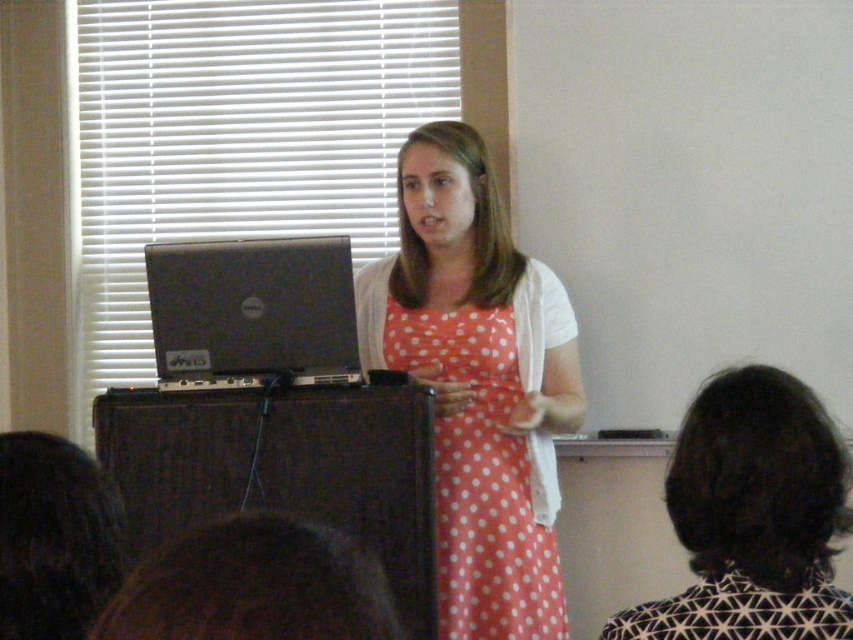
Question: Which point is closer to the camera taking this photo?

Choices:
 (A) (753, 545)
 (B) (297, 324)

Answer: (A)

Question: Which point is closer to the camera?

Choices:
 (A) silver metallic laptop at center
 (B) polka dot fabric dress at center
 (C) orange polka dot dress at center

Answer: (B)

Question: Does polka dot fabric dress at center lie in front of silver metallic laptop at center?

Choices:
 (A) no
 (B) yes

Answer: (B)

Question: Does polka dot fabric dress at center lie in front of orange polka dot dress at center?

Choices:
 (A) yes
 (B) no

Answer: (A)

Question: From the image, what is the correct spatial relationship of polka dot fabric dress at center in relation to orange polka dot dress at center?

Choices:
 (A) right
 (B) left

Answer: (A)

Question: Which point is closer to the camera?

Choices:
 (A) (805, 413)
 (B) (306, 241)

Answer: (A)